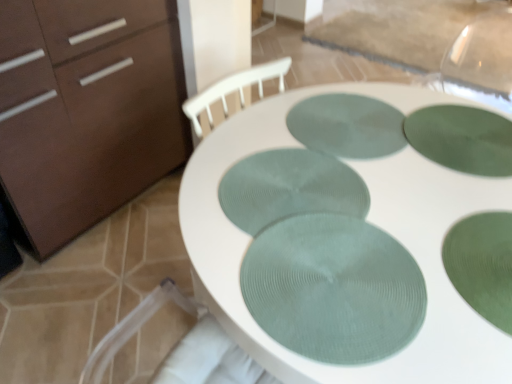
Locate an element on the screen. The width and height of the screenshot is (512, 384). vacant space in between green textured placemat at center, which is the fifth glass plate in front-to-back order, and green textured glass plate at center, the first glass plate viewed from the front is located at coordinates (333, 190).